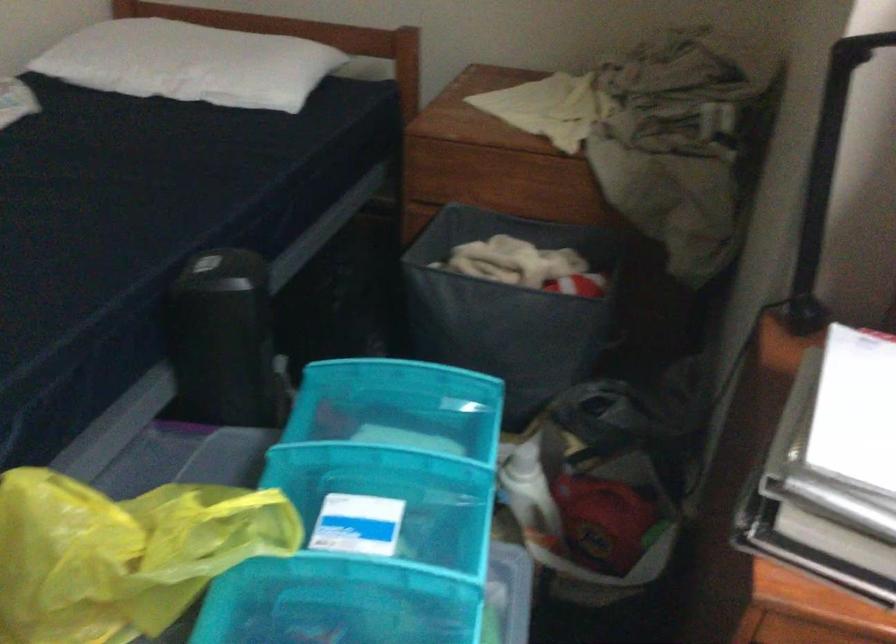
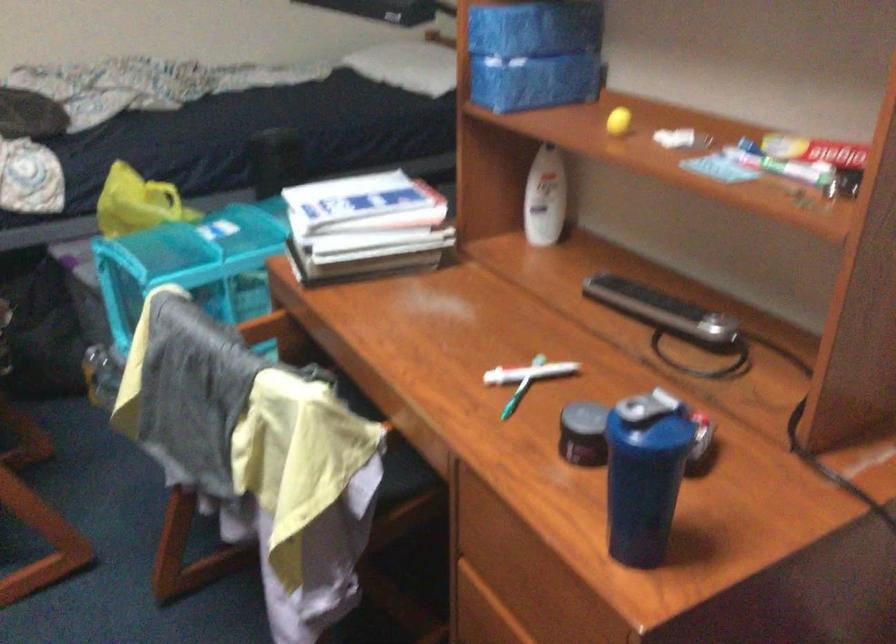
Question: I am providing you with two images of the same scene from different viewpoints. Please identify which objects are invisible in image2.

Choices:
 (A) blue drawer handle
 (B) shaker cup cap
 (C) yellow plastic bottle
 (D) black remote control

Answer: (A)